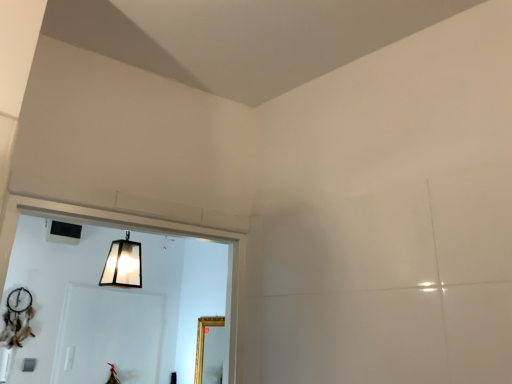
The width and height of the screenshot is (512, 384). Describe the element at coordinates (108, 336) in the screenshot. I see `white glossy screen door at upper left` at that location.

The width and height of the screenshot is (512, 384). Identify the location of white glossy screen door at upper left. point(108,336).

Find the location of a particular element. Image resolution: width=512 pixels, height=384 pixels. white glossy screen door at upper left is located at coordinates (108, 336).